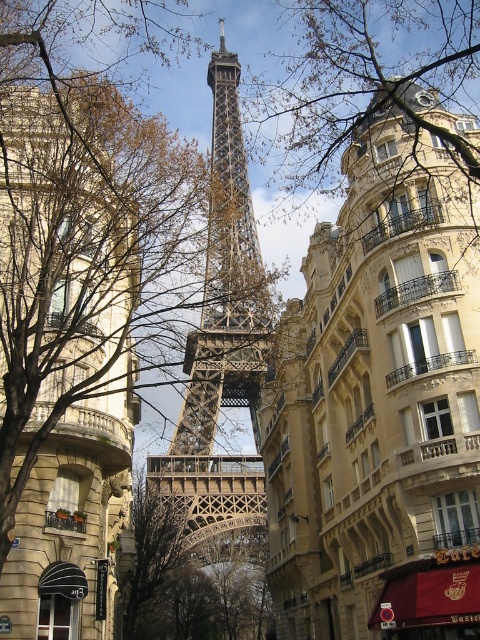
Based on the photo, you are an architect analyzing the composition of the image. Given that the golden stone building at center and the metallic lattice structure at center are both central elements, which one appears wider in the scene?

The golden stone building at center appears wider than the metallic lattice structure at center as stated in the description.

Based on the photo, you are an architect analyzing the composition of this Parisian scene. Which object, the golden stone building at center or the brown leafless branches at center, occupies a wider space in the image?

The brown leafless branches at center occupy a wider space in the image because the golden stone building at center is thinner than the brown leafless branches at center.

You are a bird flying over the Eiffel Tower scene. You see a point marked at coordinates (369, 80). What object is located at that point?

The point at coordinates (369, 80) indicates brown leafless branches at center.